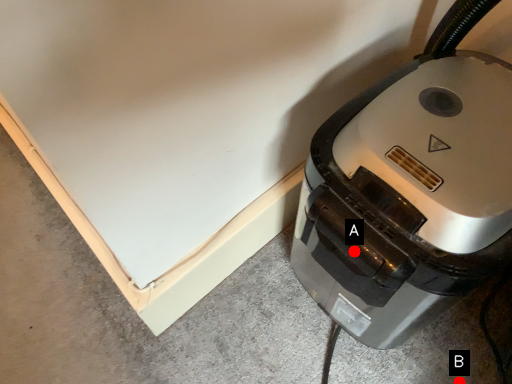
Question: Two points are circled on the image, labeled by A and B beside each circle. Which of the following is the closest to the observer?

Choices:
 (A) A is closer
 (B) B is closer

Answer: (A)